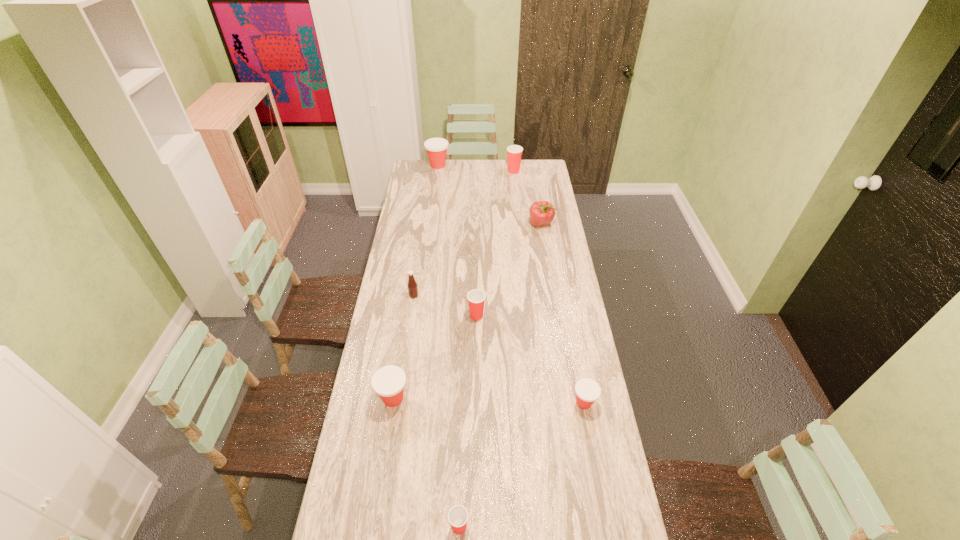
Image resolution: width=960 pixels, height=540 pixels. What are the coordinates of `vacant region located 0.330m on the left of the rightmost Dixie cup` in the screenshot? It's located at (479, 403).

Locate an element on the screen. vacant space situated on the left of the nearest object is located at coordinates pos(332,527).

At what (x,y) coordinates should I click in order to perform the action: click on Tabasco sauce that is at the left edge. Please return your answer as a coordinate pair (x, y). This screenshot has height=540, width=960. Looking at the image, I should click on (412, 285).

I want to click on bell pepper that is at the right edge, so click(542, 213).

In order to click on Dixie cup present at the right edge in this screenshot , I will do `click(587, 391)`.

Locate an element on the screen. The height and width of the screenshot is (540, 960). object that is at the far left corner is located at coordinates (436, 148).

This screenshot has height=540, width=960. What are the coordinates of `vacant space at the left edge` in the screenshot? It's located at (400, 406).

This screenshot has height=540, width=960. Identify the location of vacant space at the right edge of the desktop. (543, 254).

Find the location of a particular element. vacant point located between the pink bell pepper and the fifth farthest object is located at coordinates (509, 269).

Locate an element on the screen. The height and width of the screenshot is (540, 960). empty location between the fifth nearest object and the rightmost Dixie cup is located at coordinates (499, 349).